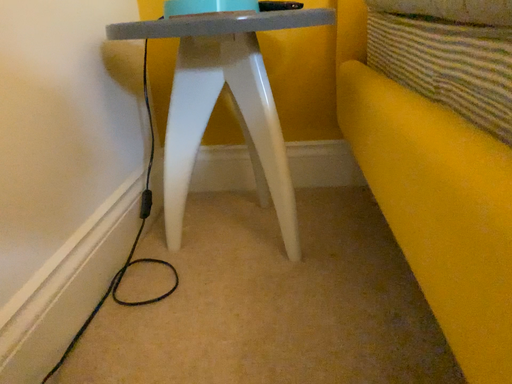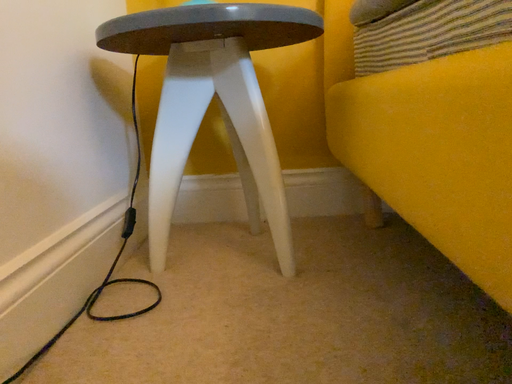
Question: How did the camera likely rotate when shooting the video?

Choices:
 (A) rotated upward
 (B) rotated downward

Answer: (A)